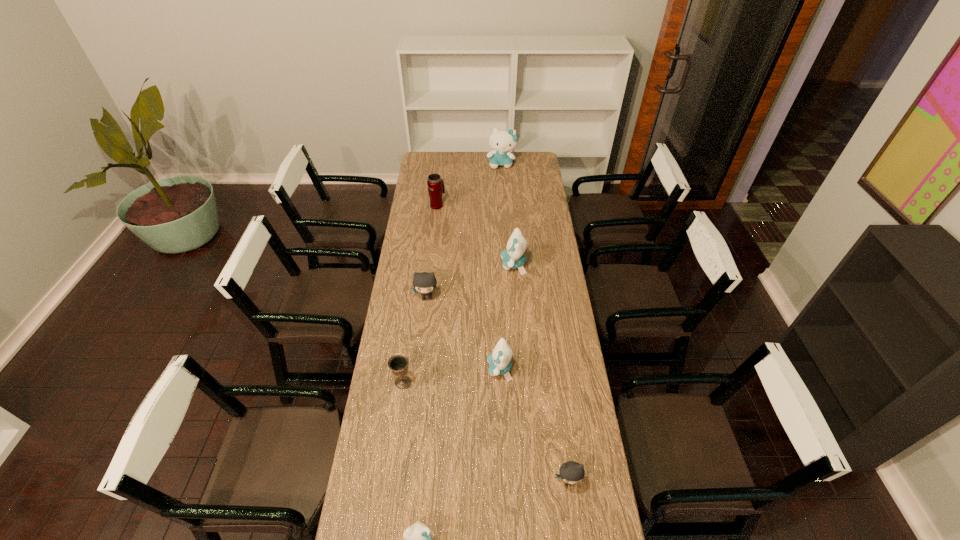
Identify the location of vacant area situated 0.270m on the face of the third biggest blue kitten. The height and width of the screenshot is (540, 960). (417, 369).

Locate an element on the screen. The image size is (960, 540). free space located on the face of the third biggest blue kitten is located at coordinates (398, 369).

This screenshot has height=540, width=960. Find the location of `vacant space situated 0.180m on the face of the third biggest blue kitten`. vacant space situated 0.180m on the face of the third biggest blue kitten is located at coordinates (441, 369).

The height and width of the screenshot is (540, 960). In order to click on vacant space located on the front-facing side of the bigger gray kitten in this screenshot , I will do coord(420,353).

You are a GUI agent. You are given a task and a screenshot of the screen. Output one action in this format:
    pyautogui.click(x=<x>, y=<y>)
    Task: Click on the vacant region located on the back of the chalice
    The height and width of the screenshot is (540, 960).
    Given the screenshot: What is the action you would take?
    click(410, 332)

At what (x,y) coordinates should I click in order to perform the action: click on vacant space located 0.090m on the front-facing side of the smaller gray kitten. Please return your answer as a coordinate pair (x, y). This screenshot has width=960, height=540. Looking at the image, I should click on (574, 523).

The height and width of the screenshot is (540, 960). Identify the location of object that is at the far edge. (502, 141).

Identify the location of thermos bottle present at the left edge. The width and height of the screenshot is (960, 540). point(436,188).

You are a GUI agent. You are given a task and a screenshot of the screen. Output one action in this format:
    pyautogui.click(x=<x>, y=<y>)
    Task: Click on the kitten at the left edge
    This screenshot has width=960, height=540.
    Given the screenshot: What is the action you would take?
    pyautogui.click(x=424, y=283)

The image size is (960, 540). What are the coordinates of `chalice at the left edge` in the screenshot? It's located at (398, 363).